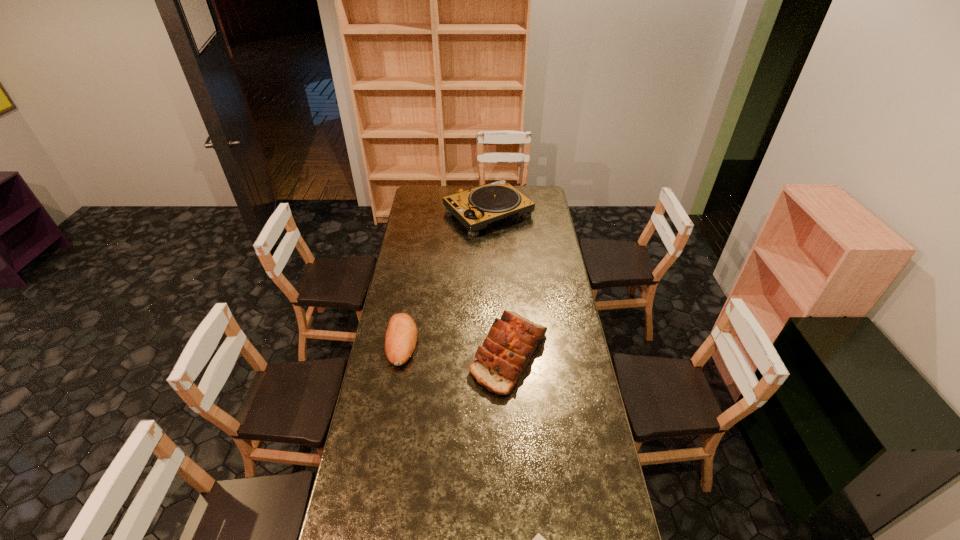
At what (x,y) coordinates should I click in order to perform the action: click on record player. Please return your answer as a coordinate pair (x, y). The height and width of the screenshot is (540, 960). Looking at the image, I should click on (475, 208).

Identify the location of the right bread. This screenshot has height=540, width=960. (511, 341).

The height and width of the screenshot is (540, 960). I want to click on the left bread, so click(x=401, y=336).

Identify the location of the leftmost object. This screenshot has height=540, width=960. (401, 336).

Identify the location of free spot located on the back of the farthest object. The width and height of the screenshot is (960, 540). (488, 187).

Where is `free space located 0.130m on the right of the right bread`? The height and width of the screenshot is (540, 960). free space located 0.130m on the right of the right bread is located at coordinates (580, 354).

Where is `free space located on the front of the left bread`? This screenshot has height=540, width=960. free space located on the front of the left bread is located at coordinates pyautogui.click(x=395, y=386).

Locate an element on the screen. The width and height of the screenshot is (960, 540). object at the far edge is located at coordinates (475, 208).

Locate an element on the screen. This screenshot has height=540, width=960. object that is at the left edge is located at coordinates (401, 336).

This screenshot has width=960, height=540. Find the location of `record player that is at the right edge`. record player that is at the right edge is located at coordinates (475, 208).